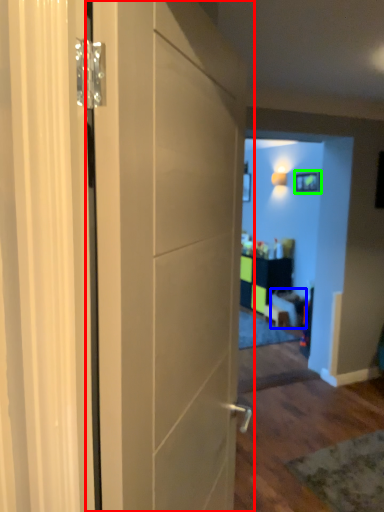
Question: Which is nearer to the door (highlighted by a red box)? furniture (highlighted by a blue box) or picture frame (highlighted by a green box).

Choices:
 (A) furniture
 (B) picture frame

Answer: (A)